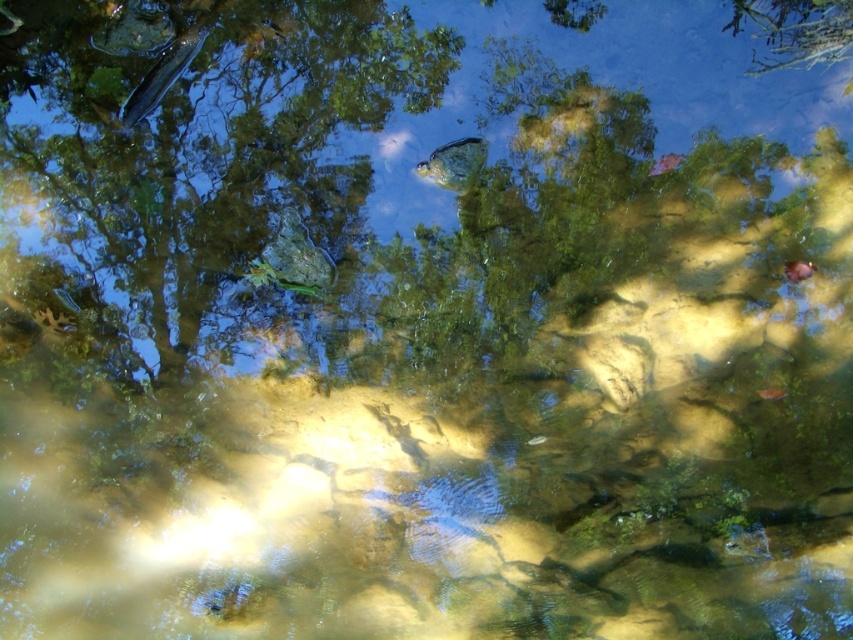
Can you confirm if shiny blue fish at upper left is positioned to the left of smooth orange fish at center?

Yes, shiny blue fish at upper left is to the left of smooth orange fish at center.

Measure the distance between shiny blue fish at upper left and camera.

shiny blue fish at upper left is 4.16 meters away from camera.

Between point (167, 65) and point (786, 269), which one is positioned behind?

Point (786, 269)

Identify the location of shiny blue fish at upper left. The height and width of the screenshot is (640, 853). (160, 76).

Which is below, shiny blue fish at upper left or translucent greenish fish at center?

translucent greenish fish at center is below.

Is point (125, 120) in front of point (485, 141)?

Yes, it is.

This screenshot has height=640, width=853. Describe the element at coordinates (160, 76) in the screenshot. I see `shiny blue fish at upper left` at that location.

This screenshot has width=853, height=640. I want to click on shiny blue fish at upper left, so click(x=160, y=76).

The height and width of the screenshot is (640, 853). Find the location of `smooth orange fish at center`. smooth orange fish at center is located at coordinates (798, 269).

Who is higher up, smooth orange fish at center or shiny orange fish at lower right?

smooth orange fish at center is above.

Identify the location of smooth orange fish at center. tap(798, 269).